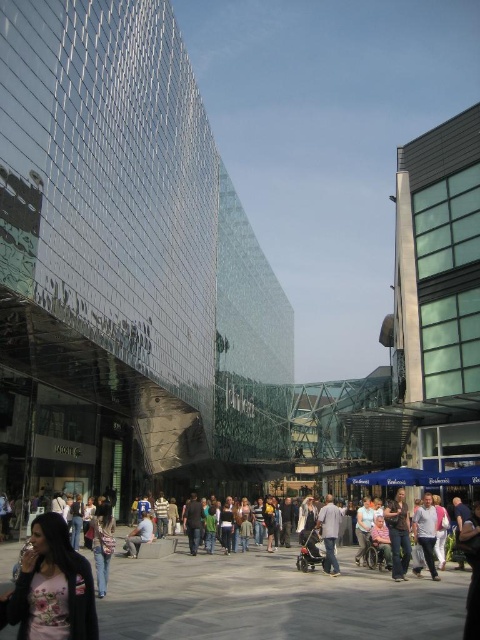
You are standing at point (52,586) in the image. What object is located at that exact point?

The floral fabric shirt at lower left is located at point (52,586).